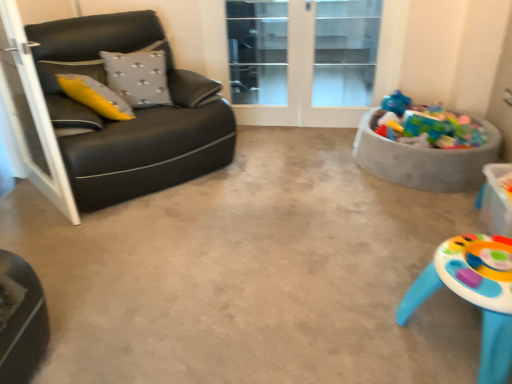
Where is `vacant space that is in between black leather couch at left and matte plastic table at lower right`? The image size is (512, 384). vacant space that is in between black leather couch at left and matte plastic table at lower right is located at coordinates (268, 242).